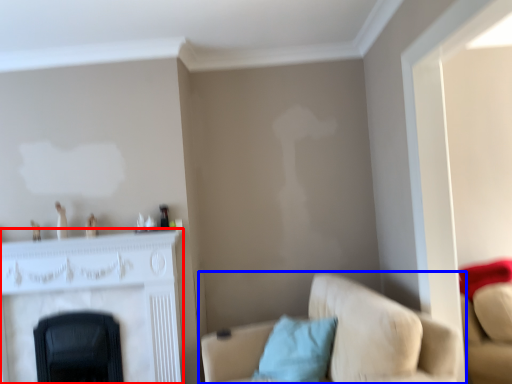
Question: Which object is further to the camera taking this photo, fireplace (highlighted by a red box) or studio couch (highlighted by a blue box)?

Choices:
 (A) fireplace
 (B) studio couch

Answer: (A)